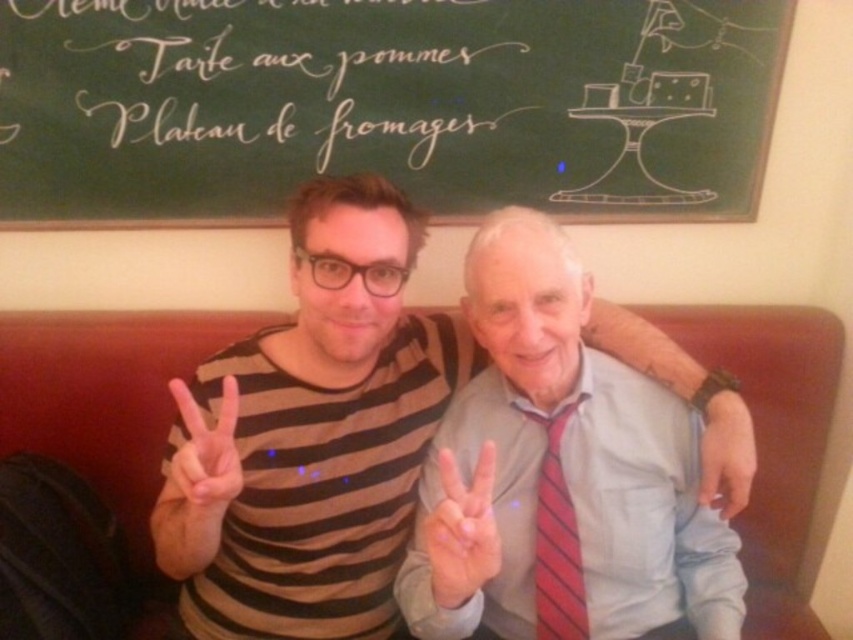
Is white matte hand at center behind red striped tie at center?

Answer: No, it is in front of red striped tie at center.

Is white matte hand at center thinner than red striped tie at center?

Incorrect, white matte hand at center's width is not less than red striped tie at center's.

I want to click on white matte hand at center, so click(x=462, y=531).

Is point (645, 173) farther from camera compared to point (567, 556)?

Yes, point (645, 173) is behind point (567, 556).

Is green chalkboard at upper center wider than red striped tie at center?

Indeed, green chalkboard at upper center has a greater width compared to red striped tie at center.

Image resolution: width=853 pixels, height=640 pixels. Find the location of `green chalkboard at upper center`. green chalkboard at upper center is located at coordinates (384, 106).

Identify the location of light blue shirt at center. Image resolution: width=853 pixels, height=640 pixels. (560, 474).

Which is below, light blue shirt at center or smooth skin hand at center?

smooth skin hand at center is lower down.

Where is `light blue shirt at center`? The height and width of the screenshot is (640, 853). light blue shirt at center is located at coordinates (560, 474).